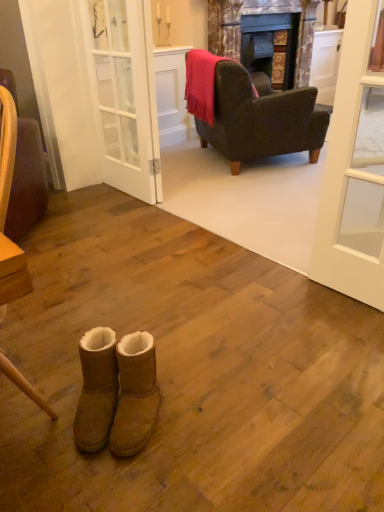
Question: Can you confirm if marble fireplace at center is smaller than white glass door at upper right?

Choices:
 (A) no
 (B) yes

Answer: (A)

Question: Considering the relative positions of marble fireplace at center and white glass door at upper right in the image provided, is marble fireplace at center in front of white glass door at upper right?

Choices:
 (A) yes
 (B) no

Answer: (B)

Question: Considering the relative sizes of marble fireplace at center and white glass door at upper right in the image provided, is marble fireplace at center thinner than white glass door at upper right?

Choices:
 (A) yes
 (B) no

Answer: (B)

Question: Is marble fireplace at center further to the viewer compared to white glass door at upper right?

Choices:
 (A) yes
 (B) no

Answer: (A)

Question: Is marble fireplace at center turned away from white glass door at upper right?

Choices:
 (A) no
 (B) yes

Answer: (A)

Question: Considering the relative positions of marble fireplace at center and white glass door at upper right in the image provided, is marble fireplace at center to the left of white glass door at upper right from the viewer's perspective?

Choices:
 (A) yes
 (B) no

Answer: (B)

Question: Does dark brown leather armchair at upper right, which is the first chair in right-to-left order, lie in front of velvet pink throw at upper center?

Choices:
 (A) yes
 (B) no

Answer: (A)

Question: Does dark brown leather armchair at upper right, positioned as the 1th chair in back-to-front order, appear on the left side of velvet pink throw at upper center?

Choices:
 (A) no
 (B) yes

Answer: (A)

Question: Is dark brown leather armchair at upper right, positioned as the 1th chair in back-to-front order, smaller than velvet pink throw at upper center?

Choices:
 (A) no
 (B) yes

Answer: (A)

Question: Is dark brown leather armchair at upper right, acting as the 2th chair starting from the left, directly adjacent to velvet pink throw at upper center?

Choices:
 (A) no
 (B) yes

Answer: (A)

Question: Can you confirm if dark brown leather armchair at upper right, placed as the 2th chair when sorted from front to back, is shorter than velvet pink throw at upper center?

Choices:
 (A) yes
 (B) no

Answer: (B)

Question: Considering the relative sizes of dark brown leather armchair at upper right, acting as the 2th chair starting from the left, and velvet pink throw at upper center in the image provided, is dark brown leather armchair at upper right, acting as the 2th chair starting from the left, taller than velvet pink throw at upper center?

Choices:
 (A) yes
 (B) no

Answer: (A)

Question: Is white glass door at center oriented towards white glass door at upper right?

Choices:
 (A) yes
 (B) no

Answer: (B)